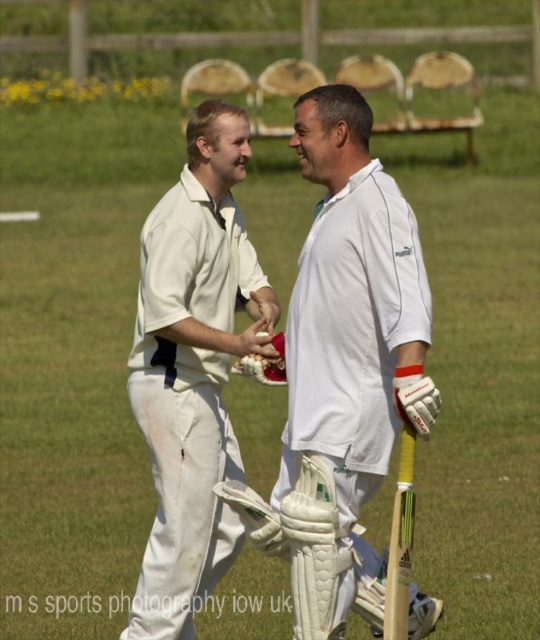
You are a spectator at the cricket field and want to know the position of the white matte cricket bat at center relative to the white leather baseball glove at center. Which object is positioned to the right?

The white matte cricket bat at center is positioned to the right of the white leather baseball glove at center.

You are a photographer trying to capture a closeup shot of both the white matte cricket bat at center and the white cloth shirt at center. Given that your camera can only focus on objects within a 30 inch range, will you be able to get both in focus?

The white matte cricket bat at center and white cloth shirt at center are 36.77 inches apart from each other. Since the distance between them exceeds the camera focus range of 30 inches, you won